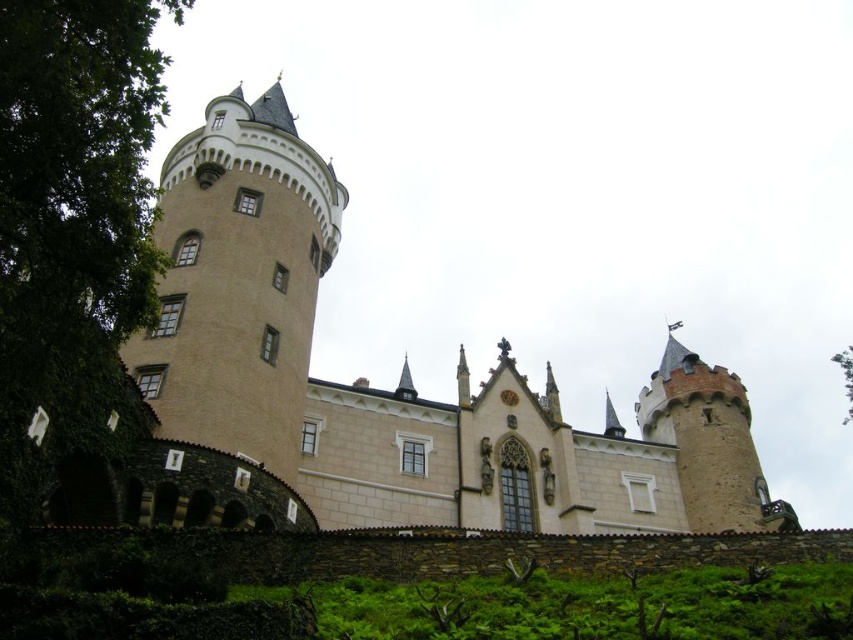
You are an architect planning to build a new structure between the beige stone castle at center and the rustic stone tower at right. Considering their widths, which side should you place the new structure to ensure it doesn

The beige stone castle at center might be wider than rustic stone tower at right, so placing the new structure closer to the rustic stone tower at right would leave more space between the two existing structures.

You are a guest approaching the castle and notice the rustic stone tower at right and the green leafy tree at upper right. Which one appears taller from your perspective?

The rustic stone tower at right appears much taller than the green leafy tree at upper right from your perspective.

You are standing in front of the castle and notice two points marked on its facade. The first point is located at coordinates point (184, 285) and the second at point (848, 385). Which of these points is positioned closer to your viewpoint?

Point (184, 285) is closer to the viewer than point (848, 385).